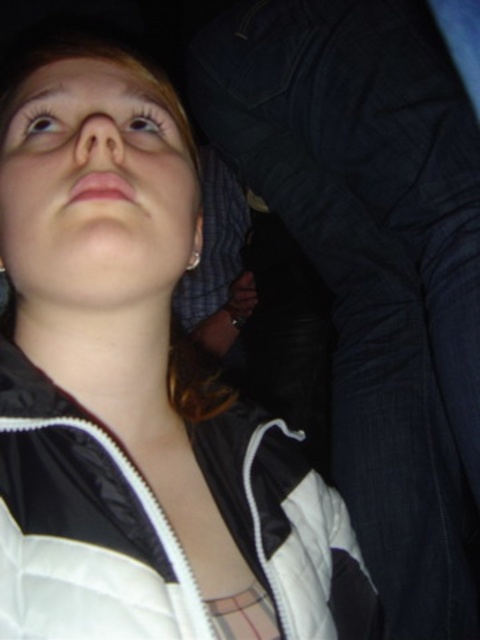
You are holding a 40 cm long measuring tape and want to measure the distance from the camera to the point at coordinates point (25, 136). Can your measuring tape reach that distance?

The distance between the camera and point (25, 136) is 46.38 centimeters. Since your measuring tape is only 40 cm long, it cannot fully reach the distance. You need a longer measuring tape.

You are a photographer adjusting your camera settings to focus on the light brown eye at upper left and the shiny brown eye at upper left. Which eye should you focus on first to ensure it appears sharp in the photo?

You should focus on the light brown eye at upper left first because it is closer to the viewer than the shiny brown eye at upper left, so focusing on the closer object ensures sharpness.